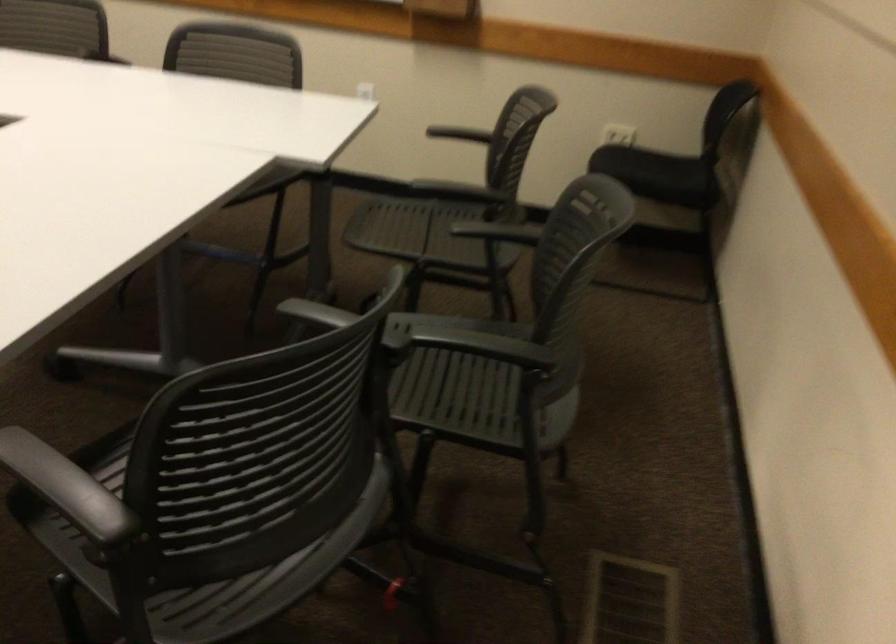
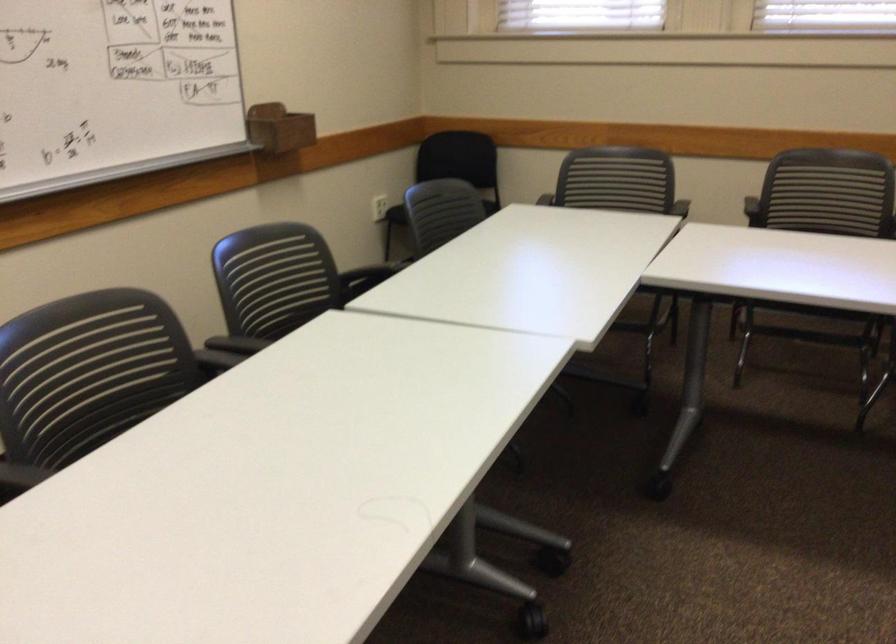
Question: I am providing you with two images of the same scene from different viewpoints. Which of the following objects are not visible in image2?

Choices:
 (A) wooden marker holder
 (B) white cabinet lid
 (C) black chair armrest
 (D) chair sitting surface

Answer: (D)